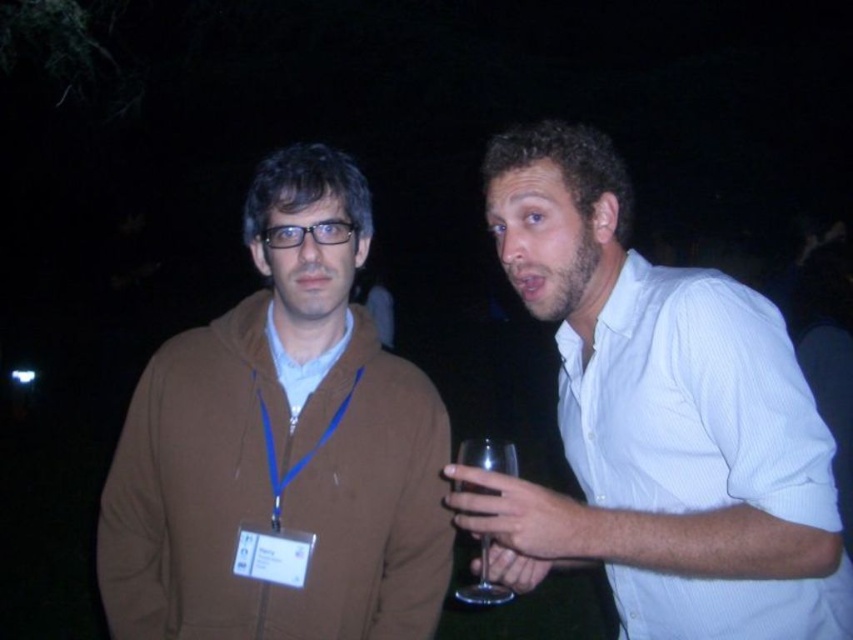
Question: Which point is closer to the camera taking this photo?

Choices:
 (A) (264, 330)
 (B) (463, 460)
 (C) (503, 564)

Answer: (B)

Question: Estimate the real-world distances between objects in this image. Which object is closer to the matte brown shirt at center?

Choices:
 (A) transparent glass at right
 (B) white textured shirt at center
 (C) brown zip-up hoodie at left

Answer: (C)

Question: Which point is farther to the camera?

Choices:
 (A) (416, 611)
 (B) (503, 458)

Answer: (A)

Question: Can you confirm if white textured shirt at center is positioned below brown zip-up hoodie at left?

Choices:
 (A) yes
 (B) no

Answer: (B)

Question: Does brown zip-up hoodie at left appear on the right side of transparent glass at right?

Choices:
 (A) no
 (B) yes

Answer: (A)

Question: Does white textured shirt at center lie in front of matte brown shirt at center?

Choices:
 (A) yes
 (B) no

Answer: (A)